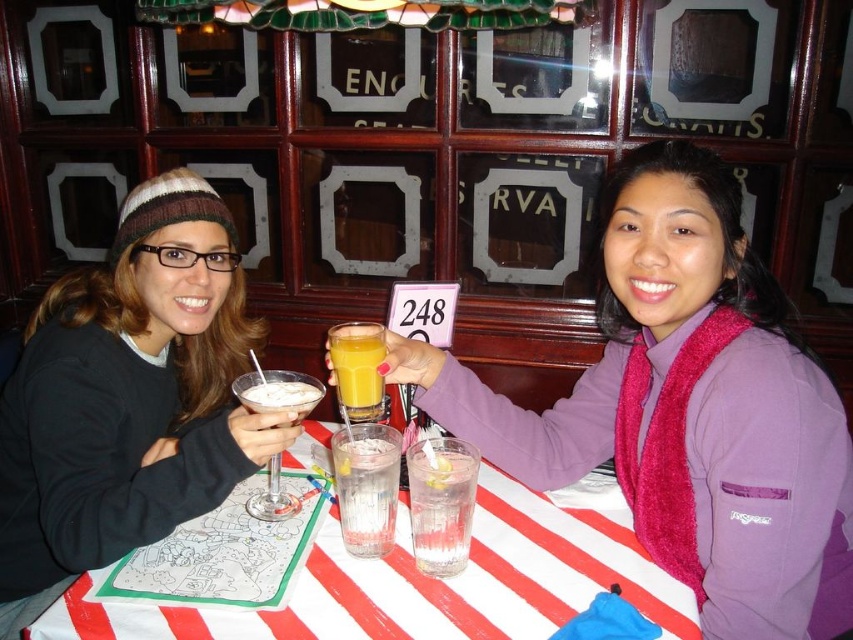
You are a bartender preparing drinks for two customers. You have a matte chocolate martini glass at center and an orange matte glass at center on the table. Which glass should you serve first if you want to follow the standard serving order from front to back?

The matte chocolate martini glass at center should be served first because it is positioned in front of the orange matte glass at center.

What is located at the coordinates point (277, 392)?

The coordinates point (277, 392) are occupied by the matte chocolate martini glass at center.

You are a bartender trying to place the matte black beanie at left and the matte chocolate martini glass at center on a shelf. The shelf has a width of 15 cm. Can both items fit side by side on the shelf?

The matte black beanie at left might be wider than the matte chocolate martini glass at center, so it is uncertain if both can fit on the 15 cm shelf. Measure their widths to confirm.